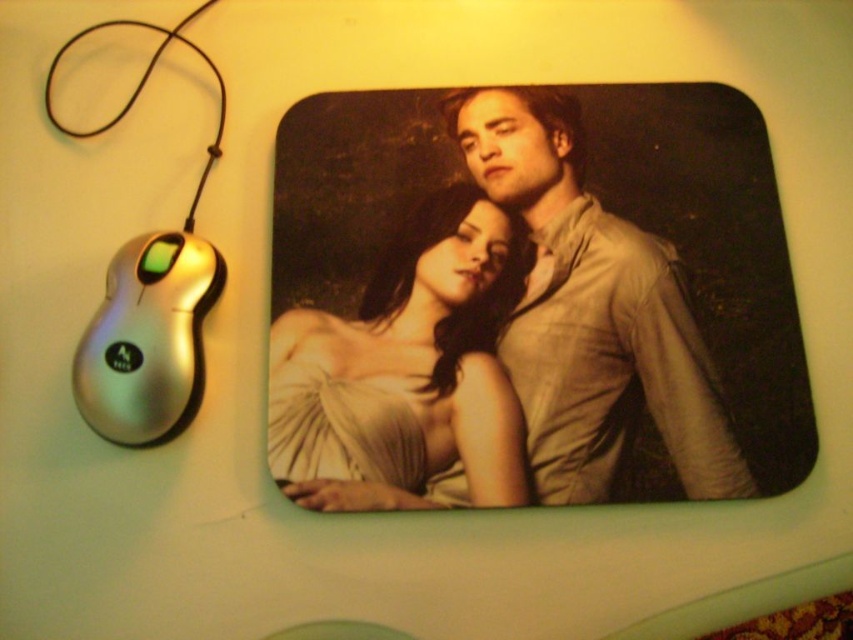
From the picture: You are organizing a small display and need to place the matte white dress at center and the silver metallic mouse at left on a shelf. If the shelf has limited space, which object should you prioritize placing first to ensure both fit?

The matte white dress at center has a larger width than the silver metallic mouse at left, so you should prioritize placing the matte white dress at center first to accommodate its greater width before placing the smaller mouse.

Based on the photo, you are designing a digital background for a greeting card and need to ensure the two figures on the mouse pad are proportionally accurate. Given the matte beige shirt at center and the matte white dress at center, which one should you scale down to maintain the correct proportions?

The matte beige shirt at center is larger in size than the matte white dress at center, so you should scale down the matte beige shirt at center to match the size of the matte white dress at center for proportional accuracy.

You are setting up a new computer desk and need to arrange your items. You have a matte beige shirt at center and a silver metallic mouse at left. According to the image, which item is positioned to the right of the other?

The matte beige shirt at center is positioned to the right of the silver metallic mouse at left.